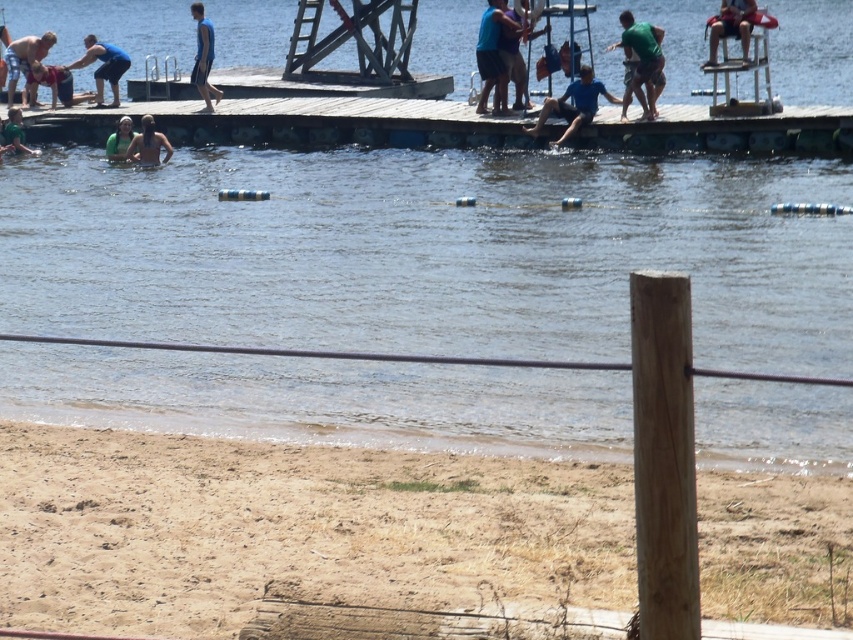
You are a photographer trying to capture both the blue fabric shirt at upper left and the matte blue swimsuit at lower left in a single shot. Given their sizes, which one will appear bigger in the photo?

The blue fabric shirt at upper left will appear bigger in the photo because it is larger in size than the matte blue swimsuit at lower left.